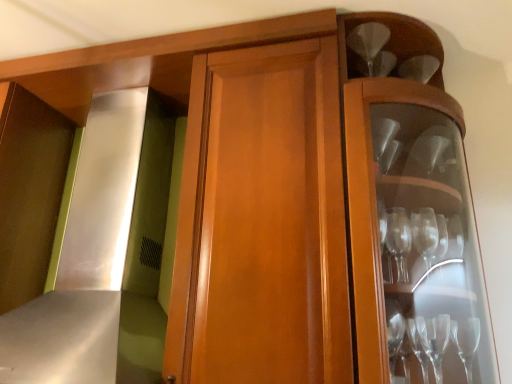
Question: Should I look upward or downward to see clear glass wine glass at upper right?

Choices:
 (A) up
 (B) down

Answer: (A)

Question: Is clear glass wine glass at upper right oriented towards satin silver exhaust hood at left?

Choices:
 (A) yes
 (B) no

Answer: (B)

Question: Are clear glass wine glass at upper right and satin silver exhaust hood at left making contact?

Choices:
 (A) yes
 (B) no

Answer: (B)

Question: From a real-world perspective, does clear glass wine glass at upper right stand above satin silver exhaust hood at left?

Choices:
 (A) no
 (B) yes

Answer: (B)

Question: Considering the relative sizes of clear glass wine glass at upper right and satin silver exhaust hood at left in the image provided, is clear glass wine glass at upper right smaller than satin silver exhaust hood at left?

Choices:
 (A) yes
 (B) no

Answer: (A)

Question: Is clear glass wine glass at upper right turned away from satin silver exhaust hood at left?

Choices:
 (A) yes
 (B) no

Answer: (B)

Question: Would you say clear glass wine glass at upper right is outside satin silver exhaust hood at left?

Choices:
 (A) yes
 (B) no

Answer: (A)

Question: Could clear glass wine glass at upper right be considered to be inside satin silver exhaust hood at left?

Choices:
 (A) yes
 (B) no

Answer: (B)

Question: Can you confirm if satin silver exhaust hood at left is wider than clear glass wine glass at upper right?

Choices:
 (A) no
 (B) yes

Answer: (B)

Question: Considering the relative sizes of satin silver exhaust hood at left and clear glass wine glass at upper right in the image provided, is satin silver exhaust hood at left bigger than clear glass wine glass at upper right?

Choices:
 (A) no
 (B) yes

Answer: (B)

Question: From the image's perspective, is satin silver exhaust hood at left below clear glass wine glass at upper right?

Choices:
 (A) yes
 (B) no

Answer: (A)

Question: Is satin silver exhaust hood at left to the left of clear glass wine glass at upper right from the viewer's perspective?

Choices:
 (A) yes
 (B) no

Answer: (A)

Question: Would you say satin silver exhaust hood at left is outside clear glass wine glass at upper right?

Choices:
 (A) yes
 (B) no

Answer: (A)

Question: From their relative heights in the image, would you say satin silver exhaust hood at left is taller or shorter than clear glass wine glass at upper right?

Choices:
 (A) short
 (B) tall

Answer: (B)